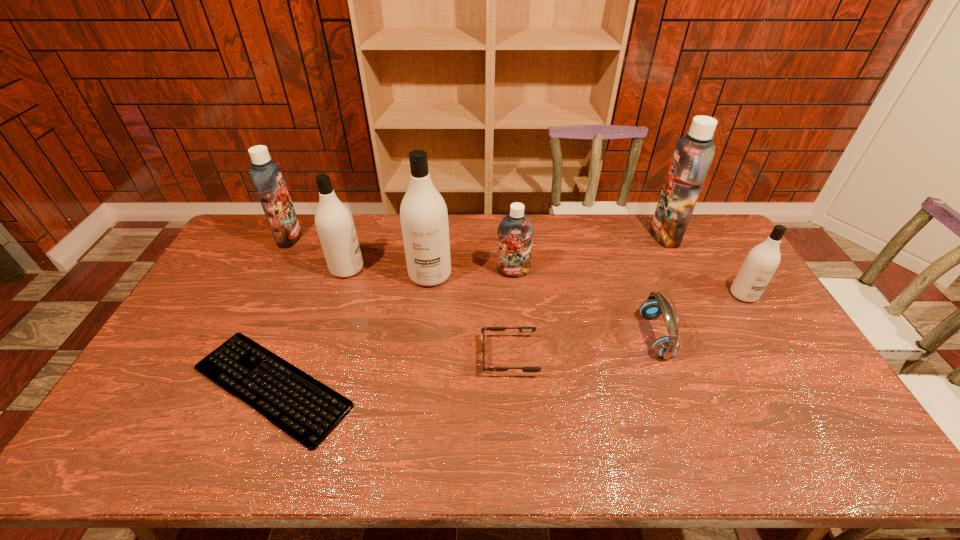
Locate an element on the screen. vacant position at the left edge of the desktop is located at coordinates (219, 298).

In the image, there is a desktop. Where is `vacant space at the far right corner`? This screenshot has height=540, width=960. vacant space at the far right corner is located at coordinates (709, 229).

What are the coordinates of `free spot between the seventh object from left to right and the fourth shampoo from right to left` in the screenshot? It's located at pos(542,305).

What are the coordinates of `empty space that is in between the leftmost shampoo and the sunglasses` in the screenshot? It's located at (399, 297).

Image resolution: width=960 pixels, height=540 pixels. I want to click on vacant space that's between the sixth object from right to left and the smallest white shampoo, so click(x=587, y=285).

You are a GUI agent. You are given a task and a screenshot of the screen. Output one action in this format:
    pyautogui.click(x=<x>, y=<y>)
    Task: Click on the free area in between the black computer keyboard and the nearest blue shampoo
    The image size is (960, 540).
    Given the screenshot: What is the action you would take?
    pyautogui.click(x=393, y=329)

The image size is (960, 540). What are the coordinates of `free spot between the second shortest object and the leftmost blue shampoo` in the screenshot? It's located at (399, 297).

The width and height of the screenshot is (960, 540). In order to click on unoccupied area between the third shampoo from left to right and the rightmost shampoo in this screenshot , I will do pyautogui.click(x=587, y=285).

The height and width of the screenshot is (540, 960). In order to click on unoccupied area between the eighth tallest object and the eighth object from left to right in this screenshot , I will do 588,296.

Where is `empty space between the sunglasses and the biggest blue shampoo`? This screenshot has width=960, height=540. empty space between the sunglasses and the biggest blue shampoo is located at coordinates (588, 296).